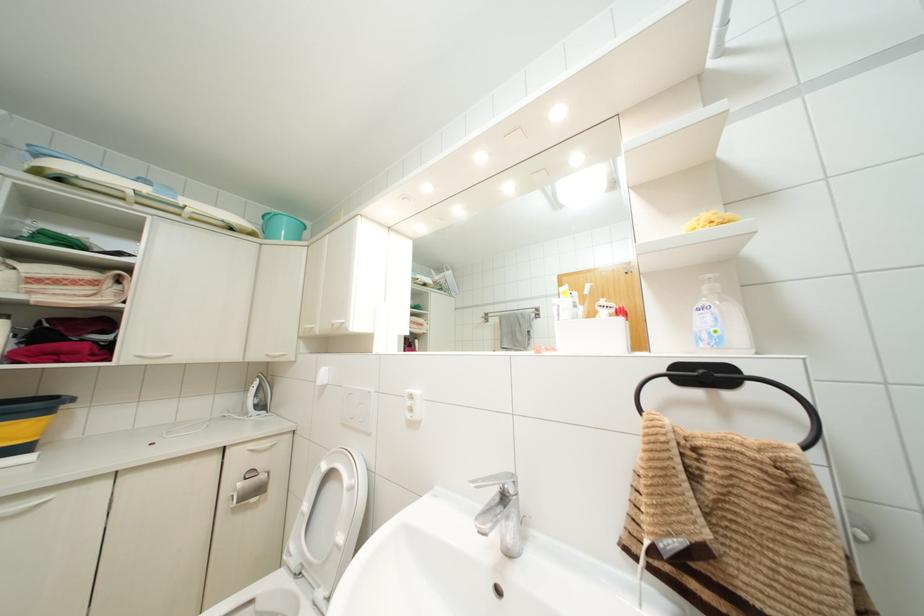
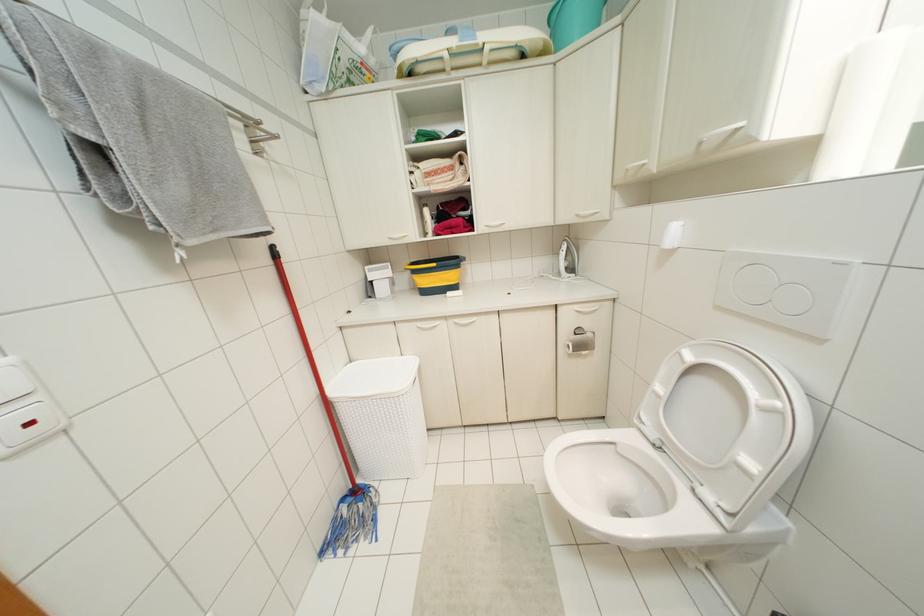
Locate, in the second image, the point that corresponds to (x=305, y=506) in the first image.

(659, 387)